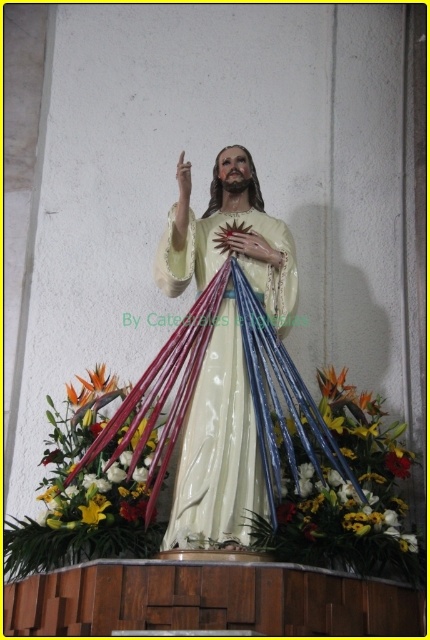
Question: Where is matte porcelain statue at center located in relation to white glossy petals at lower center in the image?

Choices:
 (A) below
 (B) above

Answer: (B)

Question: Which point is closer to the camera?

Choices:
 (A) white glossy petals at lower center
 (B) matte porcelain statue at center
 (C) vibrant floral bouquet at center

Answer: (B)

Question: In this image, where is matte porcelain statue at center located relative to vibrant floral bouquet at center?

Choices:
 (A) below
 (B) above

Answer: (B)

Question: Which of these objects is positioned closest to the white glossy petals at lower center?

Choices:
 (A) vibrant floral bouquet at center
 (B) matte porcelain statue at center

Answer: (B)

Question: Is the position of matte porcelain statue at center more distant than that of vibrant floral bouquet at center?

Choices:
 (A) no
 (B) yes

Answer: (A)

Question: Estimate the real-world distances between objects in this image. Which object is closer to the white glossy petals at lower center?

Choices:
 (A) matte porcelain statue at center
 (B) vibrant floral bouquet at center

Answer: (A)